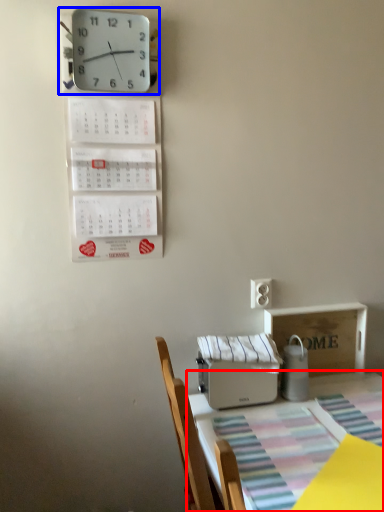
Question: Which point is closer to the camera, table (highlighted by a red box) or wall clock (highlighted by a blue box)?

Choices:
 (A) table
 (B) wall clock

Answer: (A)